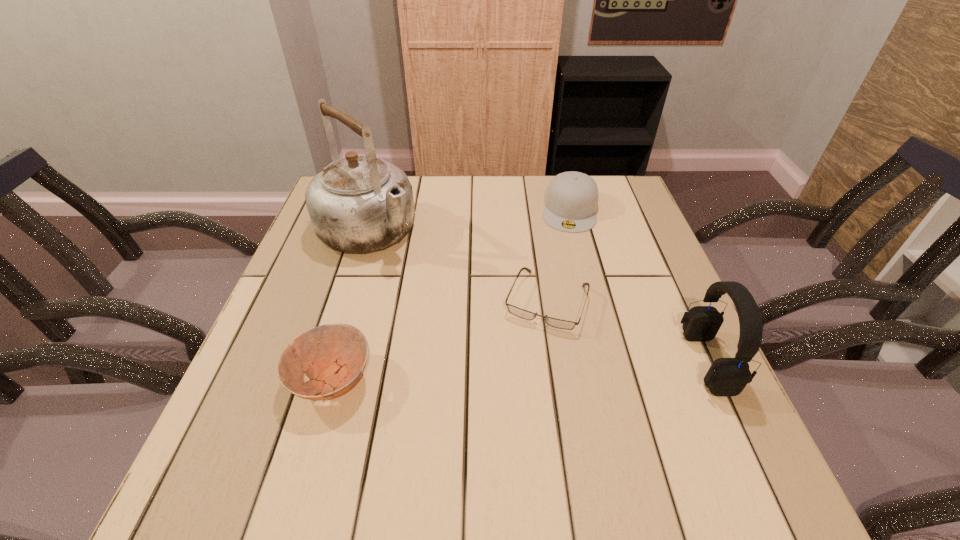
At what (x,y) coordinates should I click in order to perform the action: click on free space located at the spout of the tallest object. Please return your answer as a coordinate pair (x, y). Image resolution: width=960 pixels, height=540 pixels. Looking at the image, I should click on (482, 326).

You are a GUI agent. You are given a task and a screenshot of the screen. Output one action in this format:
    pyautogui.click(x=<x>, y=<y>)
    Task: Click on the vacant space situated at the spout of the tallest object
    This screenshot has width=960, height=540.
    Given the screenshot: What is the action you would take?
    pyautogui.click(x=452, y=301)

This screenshot has width=960, height=540. In order to click on blank area located 0.260m at the spout of the tallest object in this screenshot , I will do `click(464, 311)`.

Locate an element on the screen. The height and width of the screenshot is (540, 960). vacant space located on the front-facing side of the shortest object is located at coordinates (525, 357).

Where is `vacant space located 0.190m on the front-facing side of the shortest object`? This screenshot has width=960, height=540. vacant space located 0.190m on the front-facing side of the shortest object is located at coordinates (507, 406).

Find the location of a particular element. Image resolution: width=960 pixels, height=540 pixels. vacant area situated on the front-facing side of the shortest object is located at coordinates (494, 440).

At what (x,y) coordinates should I click in order to perform the action: click on cap positioned at the far edge. Please return your answer as a coordinate pair (x, y). Looking at the image, I should click on (571, 201).

The image size is (960, 540). Identify the location of kettle that is at the far edge. (360, 203).

At what (x,y) coordinates should I click in order to perform the action: click on bowl located at the near edge. Please return your answer as a coordinate pair (x, y). The height and width of the screenshot is (540, 960). Looking at the image, I should click on (338, 352).

What are the coordinates of `headset situated at the near edge` in the screenshot? It's located at (726, 376).